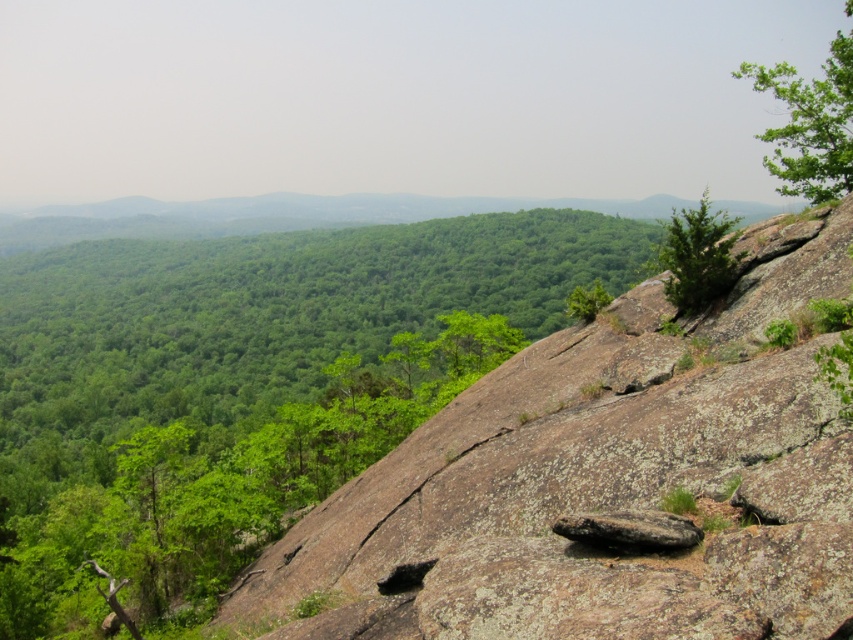
Question: Which point is closer to the camera taking this photo?

Choices:
 (A) (819, 112)
 (B) (729, 273)

Answer: (B)

Question: Can you confirm if green leafy tree at upper right is positioned to the right of green rough textured tree at upper right?

Choices:
 (A) yes
 (B) no

Answer: (A)

Question: Which of the following is the closest to the observer?

Choices:
 (A) (772, 168)
 (B) (685, 305)

Answer: (B)

Question: Is green leafy tree at upper right to the right of green rough textured tree at upper right from the viewer's perspective?

Choices:
 (A) yes
 (B) no

Answer: (A)

Question: Is green leafy tree at upper right positioned in front of green rough textured tree at upper right?

Choices:
 (A) no
 (B) yes

Answer: (A)